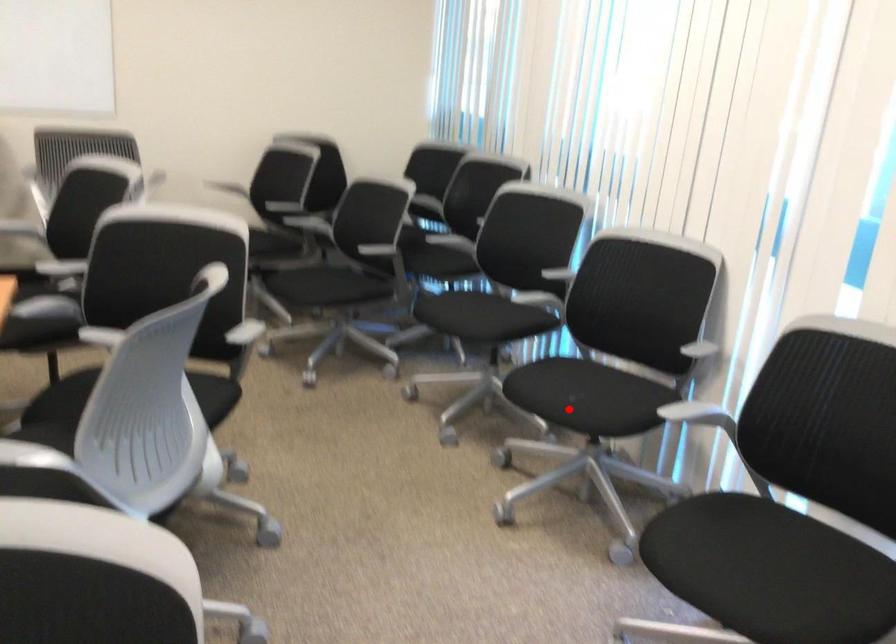
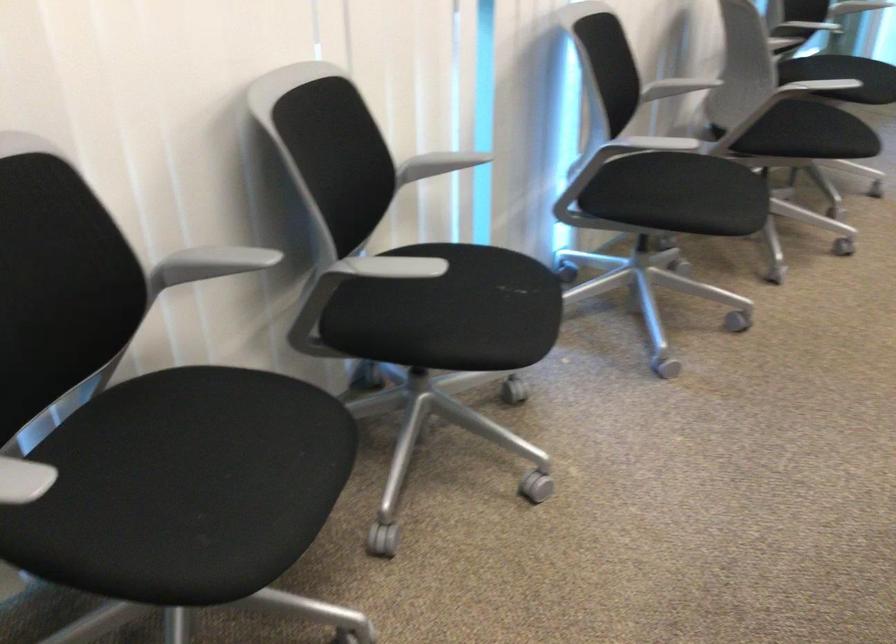
Where in the second image is the point corresponding to the highlighted location from the first image?

(515, 287)